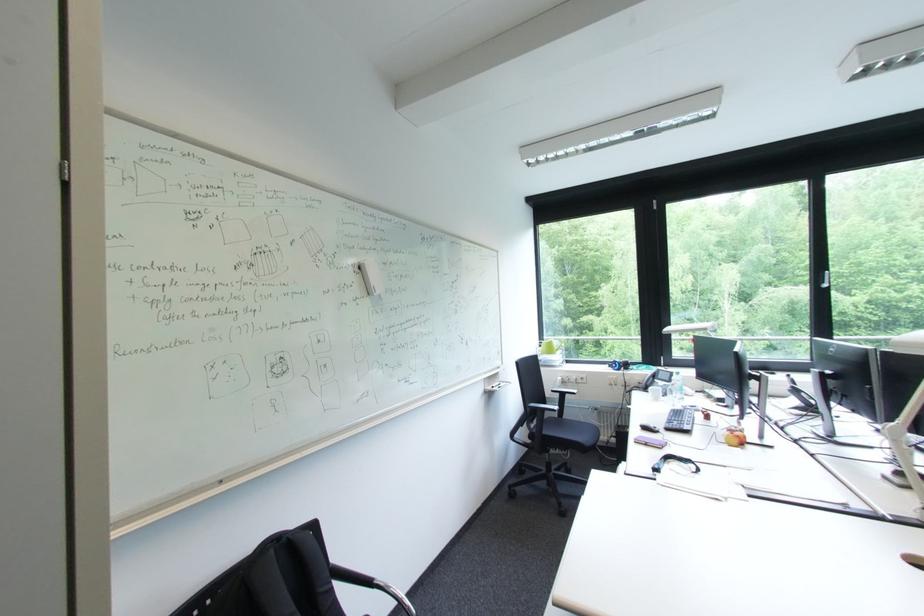
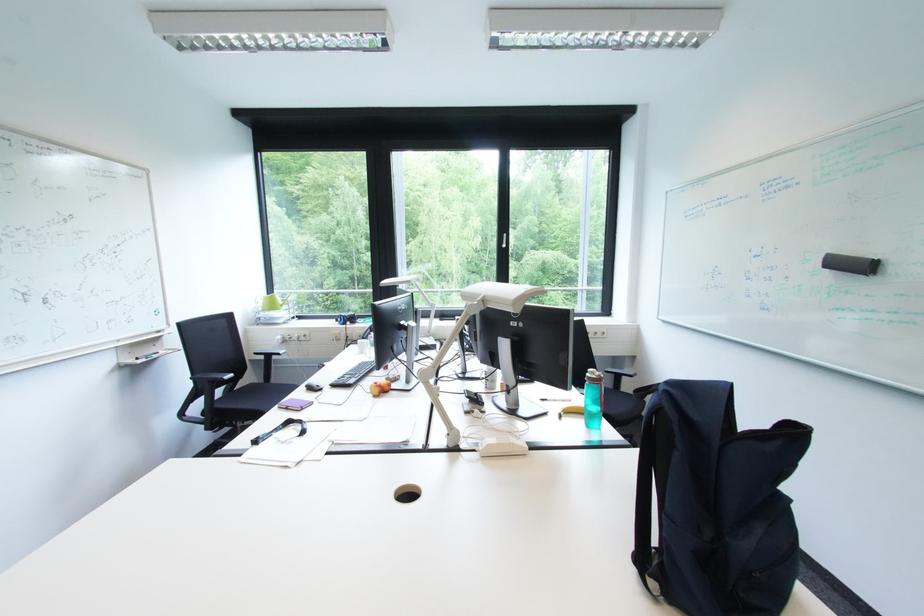
Find the pixel in the second image that matches (x=748, y=439) in the first image.

(390, 387)